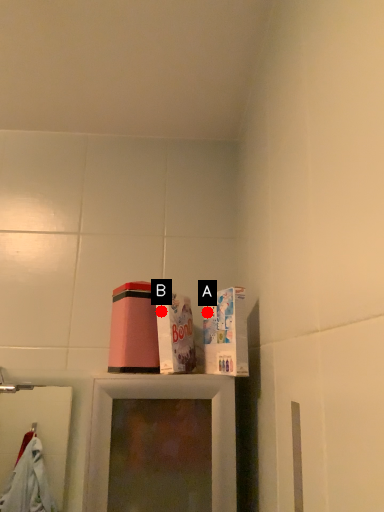
Question: Two points are circled on the image, labeled by A and B beside each circle. Which point is closer to the camera?

Choices:
 (A) A is closer
 (B) B is closer

Answer: (B)